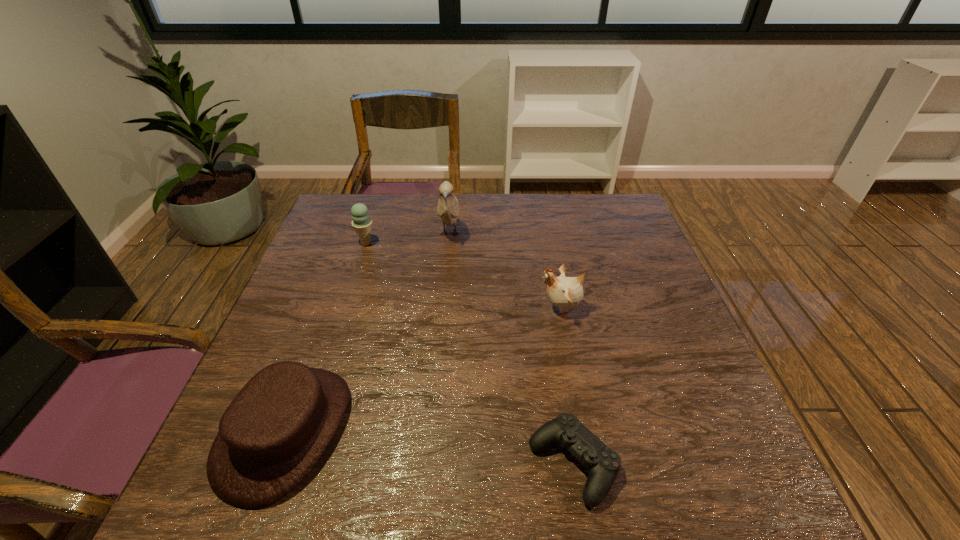
In order to click on free region located at the beak of the nearer bird in this screenshot , I will do `click(409, 308)`.

Where is `free spot located at the beak of the nearer bird`? The width and height of the screenshot is (960, 540). free spot located at the beak of the nearer bird is located at coordinates (409, 308).

This screenshot has width=960, height=540. I want to click on free space located 0.230m on the back of the fourth tallest object, so click(x=334, y=296).

Where is `free point located on the back of the control`? The width and height of the screenshot is (960, 540). free point located on the back of the control is located at coordinates (544, 288).

Image resolution: width=960 pixels, height=540 pixels. I want to click on object located at the far edge, so click(x=448, y=206).

This screenshot has height=540, width=960. Identify the location of hat situated at the near edge. (273, 433).

Find the location of a particular element. control at the near edge is located at coordinates (603, 464).

The height and width of the screenshot is (540, 960). What are the coordinates of `ice cream that is at the left edge` in the screenshot? It's located at (361, 223).

At what (x,y) coordinates should I click in order to perform the action: click on hat present at the left edge. Please return your answer as a coordinate pair (x, y). Looking at the image, I should click on (273, 433).

Locate an element on the screen. Image resolution: width=960 pixels, height=540 pixels. object present at the near left corner is located at coordinates (273, 433).